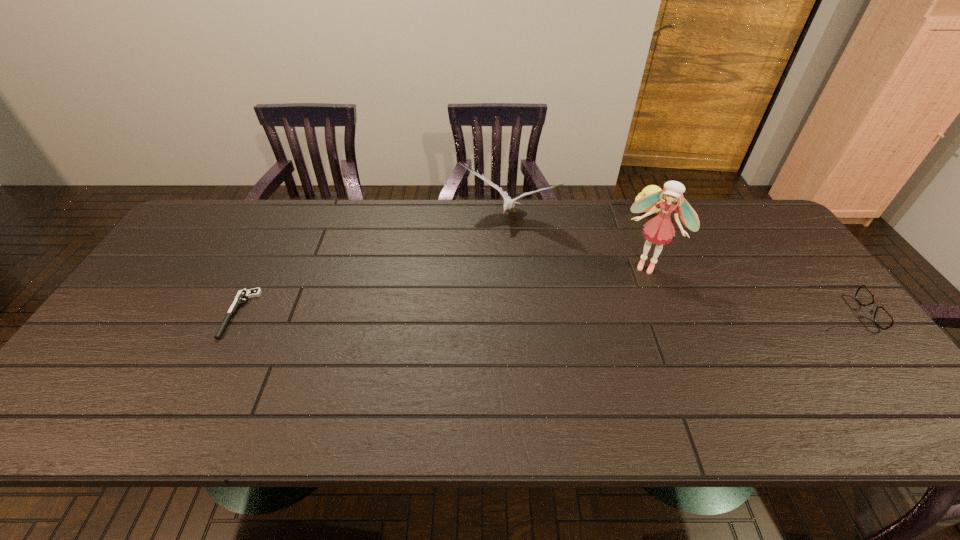
Where is `duckling situated at the far edge`? The image size is (960, 540). duckling situated at the far edge is located at coordinates (650, 189).

The image size is (960, 540). I want to click on object at the right edge, so click(x=882, y=318).

Identify the location of free space at the far edge of the desktop. (540, 201).

The image size is (960, 540). Identify the location of vacant space at the near edge of the desktop. (308, 361).

This screenshot has height=540, width=960. I want to click on vacant space at the left edge of the desktop, so click(154, 339).

Where is `vacant region at the right edge of the desktop`? vacant region at the right edge of the desktop is located at coordinates click(786, 269).

At what (x,y) coordinates should I click in order to perform the action: click on empty space that is in between the duckling and the second object from left to right. Please return your answer as a coordinate pair (x, y). Looking at the image, I should click on (578, 213).

I want to click on free spot between the fourth shortest object and the third tallest object, so click(x=578, y=213).

Find the location of a particular element. free space between the fourth tallest object and the duckling is located at coordinates (743, 261).

Find the location of a particular element. Image resolution: width=960 pixels, height=540 pixels. vacant area that lies between the fourth object from right to left and the fourth tallest object is located at coordinates (673, 265).